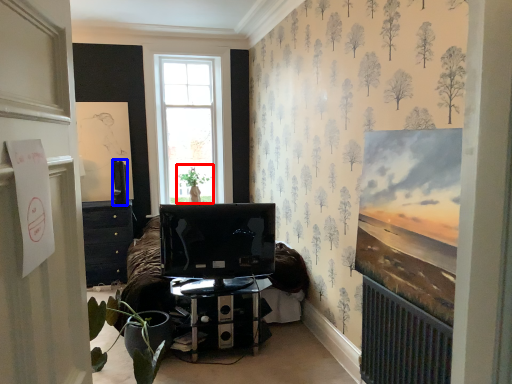
Question: Which point is closer to the camera, plant (highlighted by a red box) or television (highlighted by a blue box)?

Choices:
 (A) plant
 (B) television

Answer: (B)